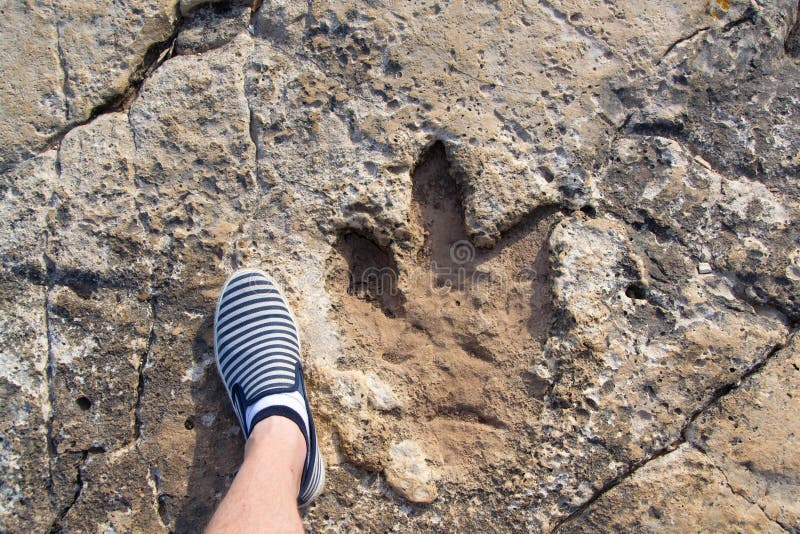
At what (x,y) coordinates should I click in order to perform the action: click on sock. Please return your answer as a coordinate pair (x, y). This screenshot has width=800, height=534. Looking at the image, I should click on [292, 408].